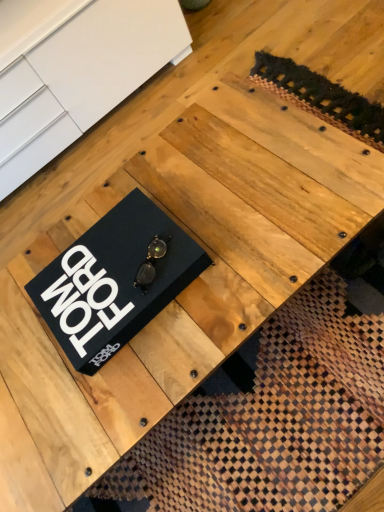
Question: Can you confirm if black matte book at center is taller than black matte box at center?

Choices:
 (A) no
 (B) yes

Answer: (B)

Question: Is black matte book at center smaller than black matte box at center?

Choices:
 (A) no
 (B) yes

Answer: (A)

Question: Is black matte box at center a part of black matte book at center?

Choices:
 (A) no
 (B) yes

Answer: (A)

Question: Does black matte book at center turn towards black matte box at center?

Choices:
 (A) no
 (B) yes

Answer: (B)

Question: Is black matte book at center completely or partially outside of black matte box at center?

Choices:
 (A) yes
 (B) no

Answer: (A)

Question: Does black matte book at center appear on the left side of black matte box at center?

Choices:
 (A) no
 (B) yes

Answer: (B)

Question: Is black matte box at center positioned behind black matte book at center?

Choices:
 (A) no
 (B) yes

Answer: (A)

Question: Are black matte box at center and black matte book at center making contact?

Choices:
 (A) no
 (B) yes

Answer: (A)

Question: Is black matte box at center in front of black matte book at center?

Choices:
 (A) no
 (B) yes

Answer: (B)

Question: Considering the relative sizes of black matte box at center and black matte book at center in the image provided, is black matte box at center shorter than black matte book at center?

Choices:
 (A) yes
 (B) no

Answer: (A)

Question: From the image's perspective, is black matte box at center beneath black matte book at center?

Choices:
 (A) no
 (B) yes

Answer: (B)

Question: Is black matte box at center at the left side of black matte book at center?

Choices:
 (A) no
 (B) yes

Answer: (A)

Question: Visually, is black matte box at center positioned to the left or to the right of black matte book at center?

Choices:
 (A) right
 (B) left

Answer: (A)